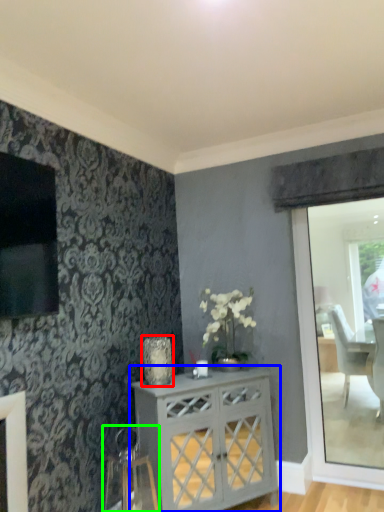
Question: Which object is positioned farthest from vase (highlighted by a red box)? Select from desk (highlighted by a blue box) and swivel chair (highlighted by a green box).

Choices:
 (A) desk
 (B) swivel chair

Answer: (B)